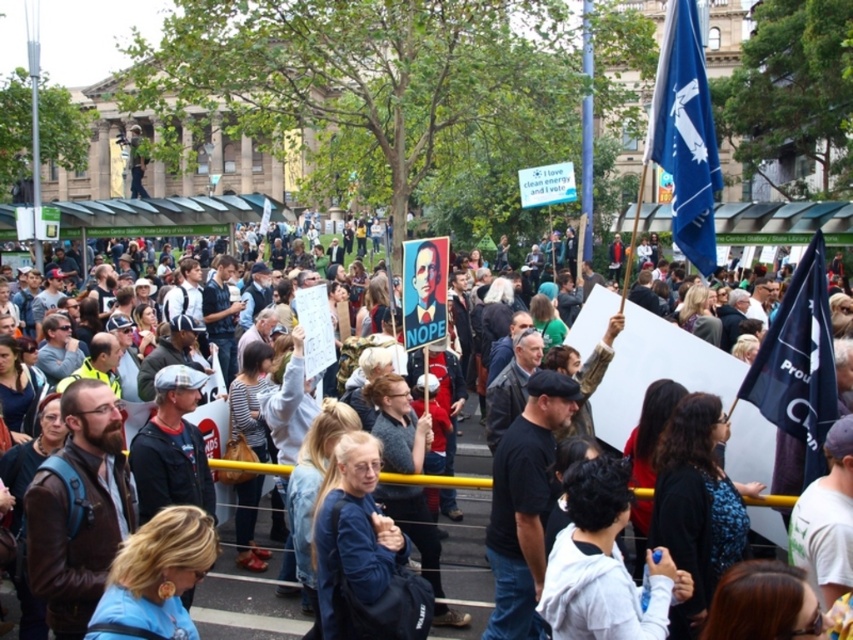
Who is positioned more to the left, blue fabric flag at upper right or dark blue fabric flag at center-right?

From the viewer's perspective, blue fabric flag at upper right appears more on the left side.

Does point (705, 83) come in front of point (788, 321)?

No.

Describe the element at coordinates (685, 134) in the screenshot. Image resolution: width=853 pixels, height=640 pixels. I see `blue fabric flag at upper right` at that location.

You are a GUI agent. You are given a task and a screenshot of the screen. Output one action in this format:
    pyautogui.click(x=<x>, y=<y>)
    Task: Click on the blue fabric flag at upper right
    The image size is (853, 640).
    Given the screenshot: What is the action you would take?
    pyautogui.click(x=685, y=134)

Who is more forward, (485, 586) or (785, 346)?

Point (785, 346)

Consider the image. Who is positioned more to the left, white paper sign at center or dark blue fabric flag at center-right?

white paper sign at center

What do you see at coordinates (242, 608) in the screenshot?
I see `white paper sign at center` at bounding box center [242, 608].

The image size is (853, 640). I want to click on white paper sign at center, so click(242, 608).

Is the position of white paper sign at center more distant than that of blue fabric flag at upper right?

No, it is in front of blue fabric flag at upper right.

Who is positioned more to the left, white paper sign at center or blue fabric flag at upper right?

Positioned to the left is white paper sign at center.

Describe the element at coordinates (242, 608) in the screenshot. I see `white paper sign at center` at that location.

This screenshot has width=853, height=640. I want to click on white paper sign at center, so click(x=242, y=608).